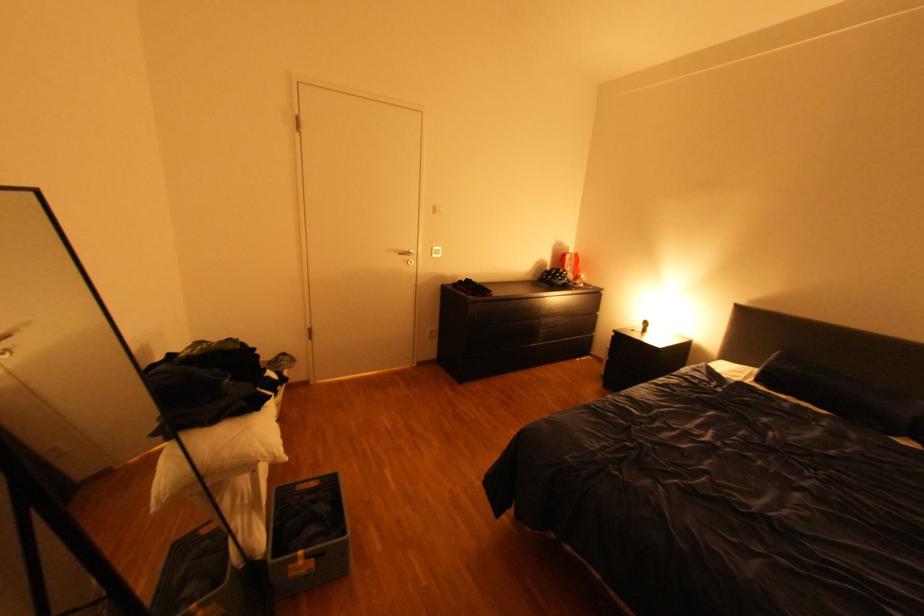
Which object does [219,451] point to?

It refers to a white pillow.